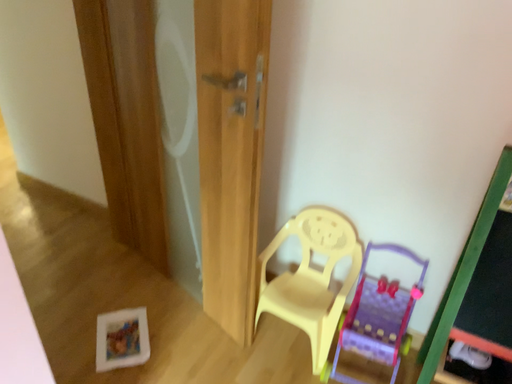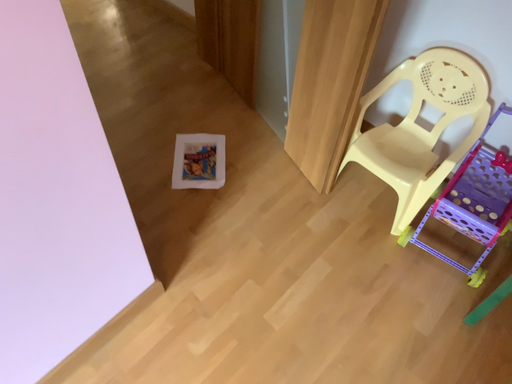
Question: How did the camera likely rotate when shooting the video?

Choices:
 (A) rotated right
 (B) rotated left

Answer: (B)